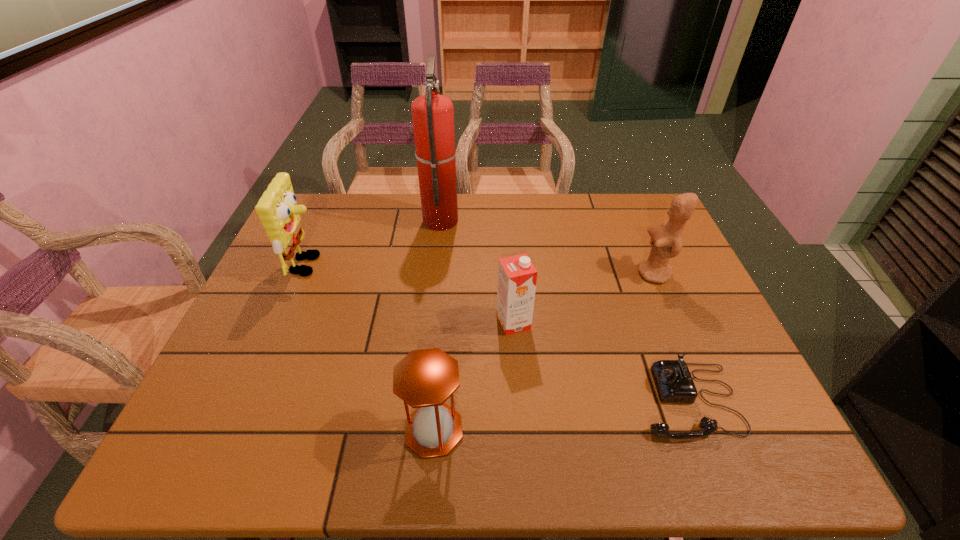
The height and width of the screenshot is (540, 960). Identify the location of the farthest object. (433, 114).

Find the location of a particular element. This screenshot has width=960, height=540. fire extinguisher is located at coordinates (433, 114).

The width and height of the screenshot is (960, 540). In order to click on figurine in this screenshot , I will do `click(666, 240)`.

Locate an element on the screen. The image size is (960, 540). sponge is located at coordinates (277, 209).

The width and height of the screenshot is (960, 540). What are the coordinates of `carton` in the screenshot? It's located at (517, 277).

Find the location of `the fourth object from left to right`. the fourth object from left to right is located at coordinates (517, 277).

Locate an element on the screen. hourglass is located at coordinates (424, 379).

At what (x,y) coordinates should I click in order to perform the action: click on the shortest object. Please return your answer as a coordinate pair (x, y). This screenshot has width=960, height=540. Looking at the image, I should click on (674, 383).

Locate an element on the screen. vacant space located with the nozzle and gauge on the farthest object is located at coordinates (480, 219).

Where is `vacant space located on the front-facing side of the figurine`? The image size is (960, 540). vacant space located on the front-facing side of the figurine is located at coordinates (517, 274).